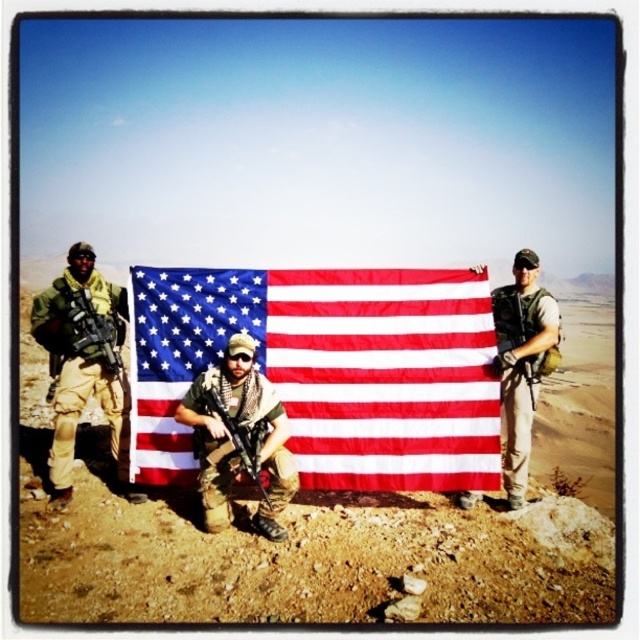
You are a drone operator trying to identify the central figure in the desert scene. According to the coordinates provided, where exactly is the camouflage fabric uniform at center positioned?

The camouflage fabric uniform at center is located at point (240, 436).

You are a photographer trying to capture the flag held by the three soldiers in the desert. You want to ensure that both points on the flag, point (419,477) and point (195,438), are clearly visible in your photo. Which point should you focus on to ensure it appears closer to the camera?

You should focus on point (419,477) because it is further to the camera than point (195,438).